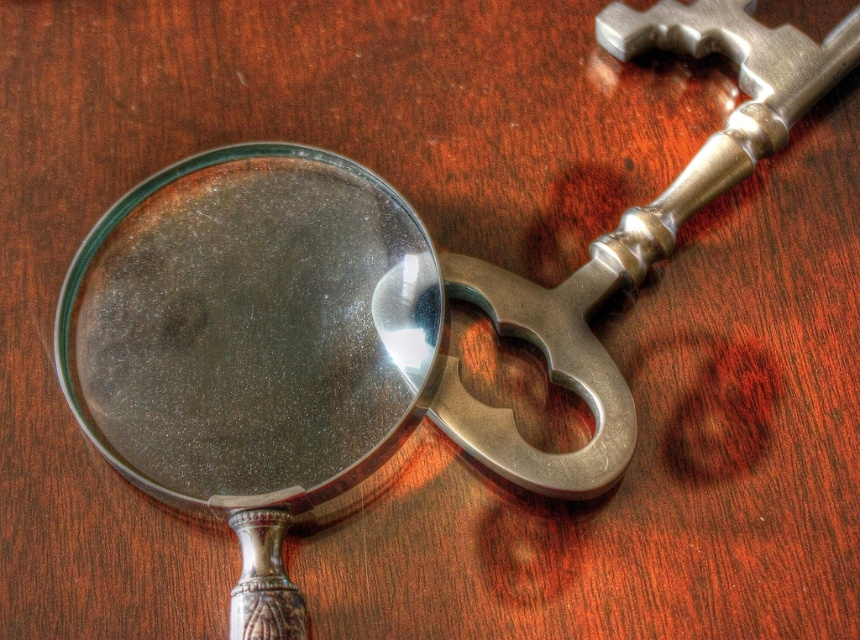
You are looking at the wooden surface where the magnifying glass and key are placed. There are two points marked on the image at coordinates point [252,484] and point [701,154]. If you were to move your gaze from the magnifying glass towards the key, which point would you pass over first?

You would pass over point [252,484] first because it is closer to the camera than point [701,154].

You are a detective trying to examine the polished metal key at upper right with the matte silver magnifying glass at center. Can you move the magnifying glass close enough to the key to inspect it without moving the key?

The matte silver magnifying glass at center is 9.45 inches away from the polished metal key at upper right. Since the magnifying glass needs to be close to the object for examination, the distance between them is too large for effective inspection without moving the key.

You are a detective examining the scene. You need to determine the relative positions of the matte silver magnifying glass at center and the polished metal key at upper right. Which object is located to the left of the other?

The matte silver magnifying glass at center is positioned on the left side of polished metal key at upper right.